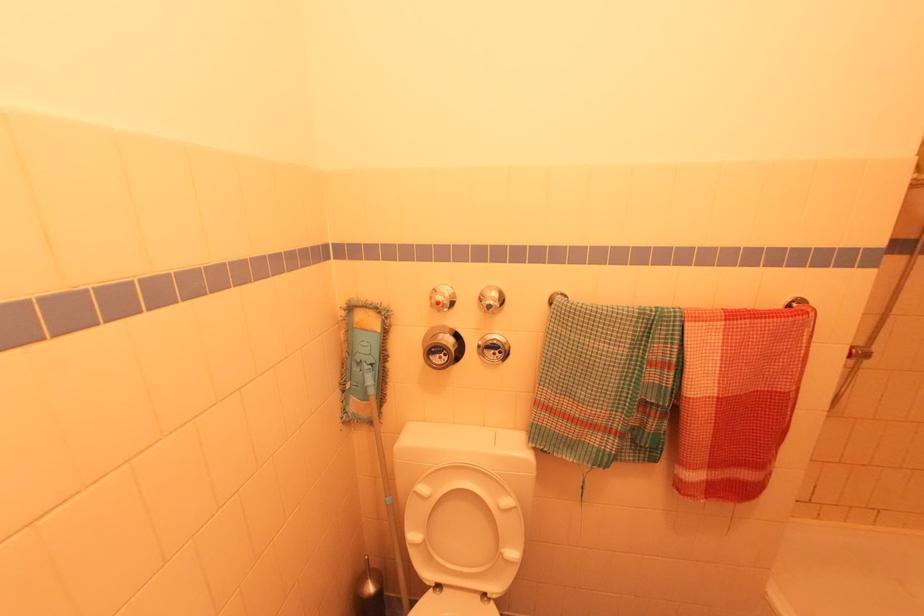
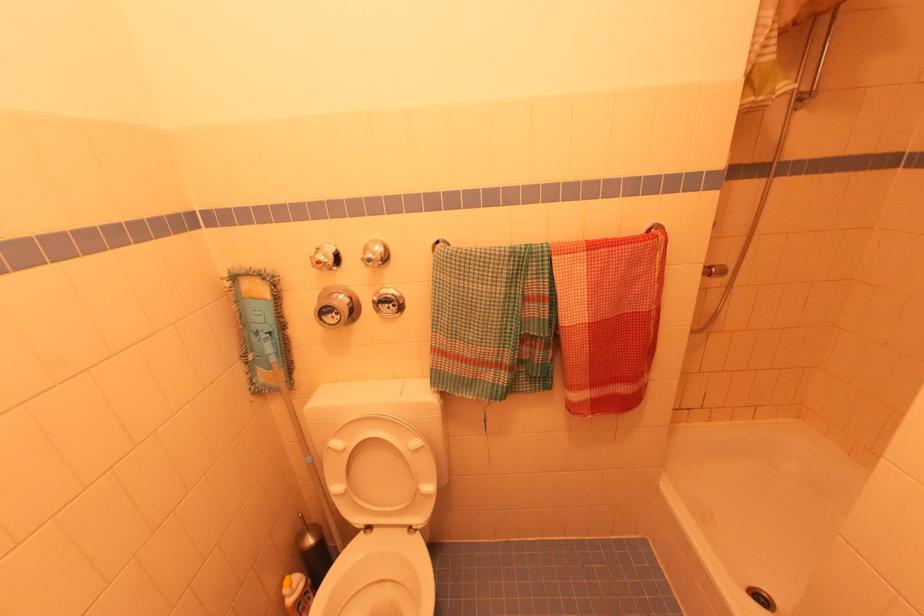
In the second image, find the point that corresponds to [421,483] in the first image.

(334, 439)